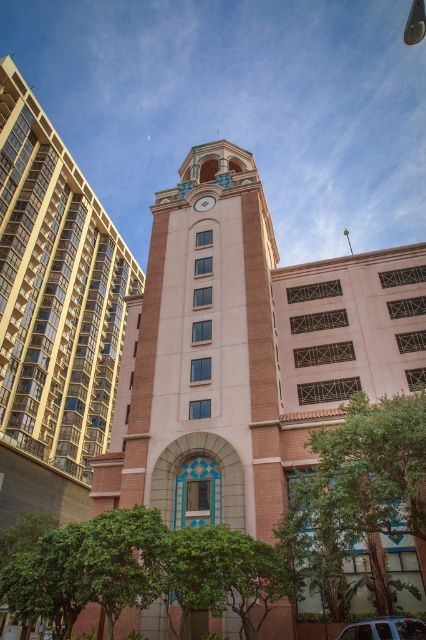
You are standing in front of the building complex and want to determine which of the two points, point (42, 296) or point (212, 202), is closer to you. Based on the image, which point is nearer?

Point (42, 296) is closer to you because it is further to the viewer than point (212, 202).

You are standing in front of the beige brick clock tower at center and the matte gold clock at center. Which one is positioned higher up in the image?

The matte gold clock at center is positioned higher up because the beige brick clock tower at center is located below it.